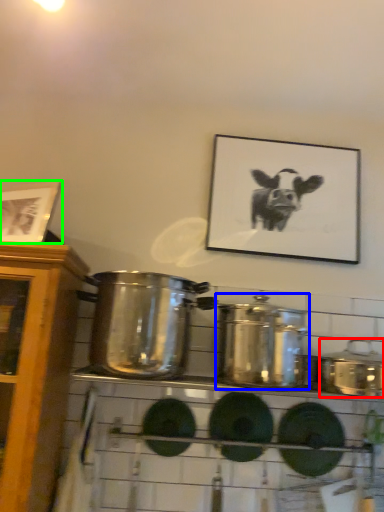
Question: Considering the real-world distances, which object is farthest from crock pot (highlighted by a red box)? crock pot (highlighted by a blue box) or picture frame (highlighted by a green box)?

Choices:
 (A) crock pot
 (B) picture frame

Answer: (B)